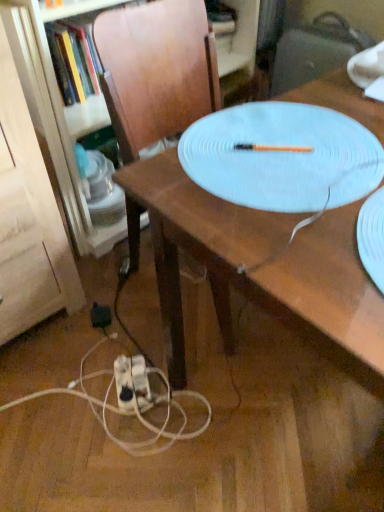
The width and height of the screenshot is (384, 512). Identify the location of free spot behind black plastic electric outlet at lower left. (109, 287).